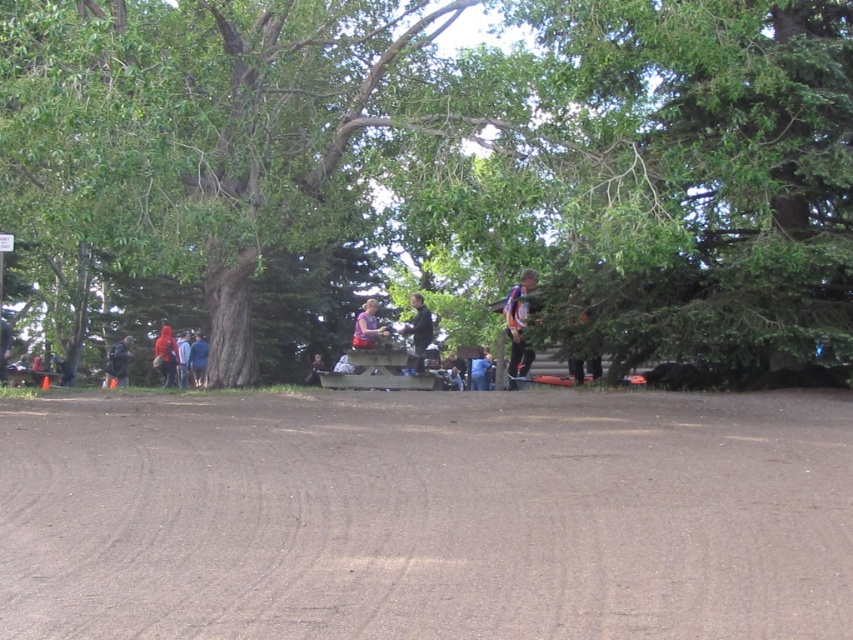
Can you confirm if dark gray jacket at left is positioned to the left of dark gray fabric jacket at center?

Yes, dark gray jacket at left is to the left of dark gray fabric jacket at center.

The image size is (853, 640). In order to click on dark gray jacket at left in this screenshot , I will do `click(119, 362)`.

Can you confirm if green leafy tree at center is positioned above blue and white jersey at center?

Yes.

Between green leafy tree at center and blue and white jersey at center, which one has less height?

Standing shorter between the two is blue and white jersey at center.

Identify the location of green leafy tree at center. pyautogui.click(x=445, y=164).

Can you confirm if dark blue shirt at center is positioned to the right of dark gray fabric jacket at center?

Correct, you'll find dark blue shirt at center to the right of dark gray fabric jacket at center.

Measure the distance between dark blue shirt at center and dark gray fabric jacket at center.

They are 18.15 feet apart.

Between point (410, 300) and point (314, 358), which one is positioned in front?

Positioned in front is point (410, 300).

What are the coordinates of `dark blue shirt at center` in the screenshot? It's located at (419, 328).